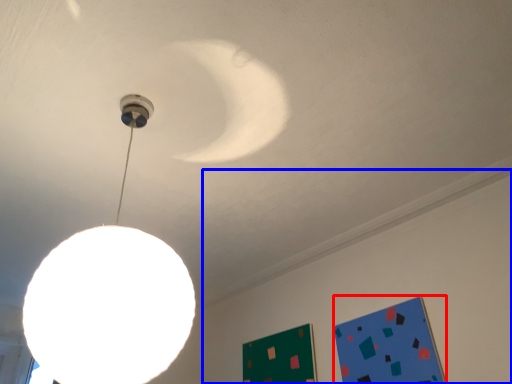
Question: Among these objects, which one is farthest to the camera, bulletin board (highlighted by a red box) or backdrop (highlighted by a blue box)?

Choices:
 (A) bulletin board
 (B) backdrop

Answer: (A)